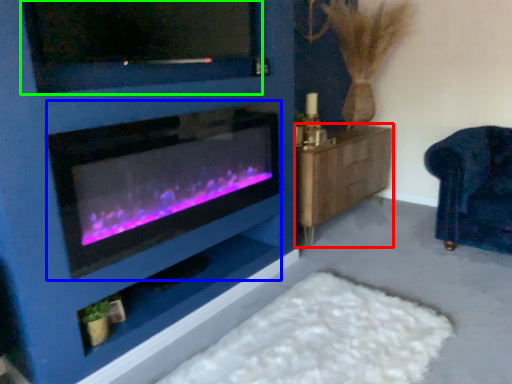
Question: Estimate the real-world distances between objects in this image. Which object is farther from dresser (highlighted by a red box), wood burning stove (highlighted by a blue box) or tv show (highlighted by a green box)?

Choices:
 (A) wood burning stove
 (B) tv show

Answer: (B)